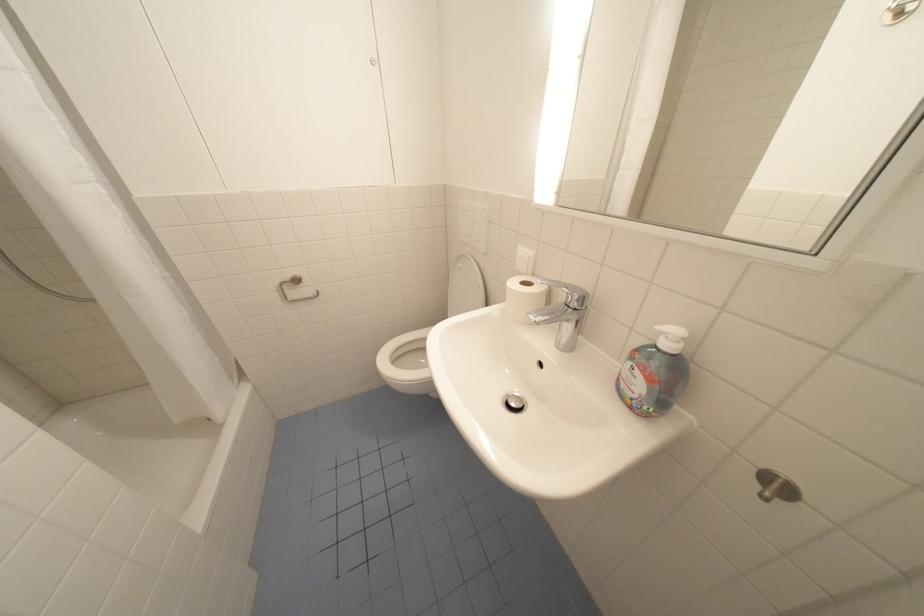
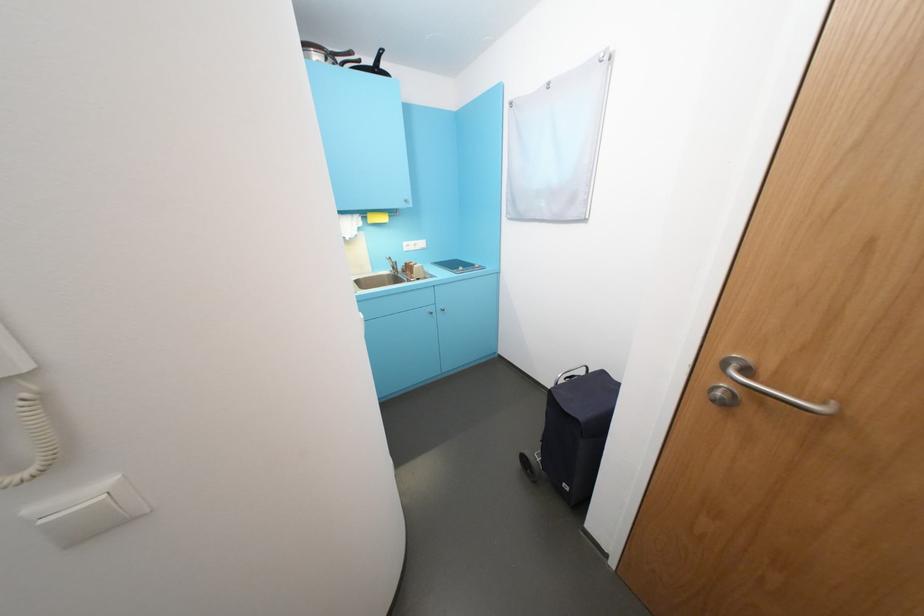
Which direction would the cameraman need to move to produce the second image?

The cameraman walked toward right, backward.